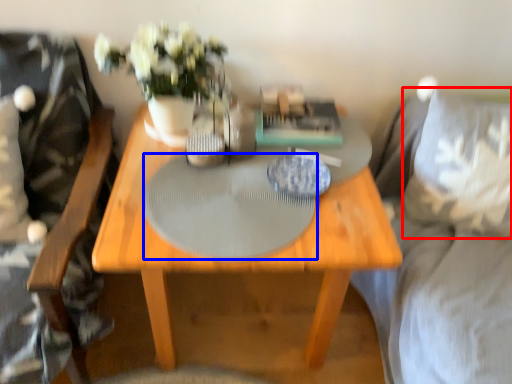
Question: Among these objects, which one is nearest to the camera, pillow (highlighted by a red box) or glass table (highlighted by a blue box)?

Choices:
 (A) pillow
 (B) glass table

Answer: (B)